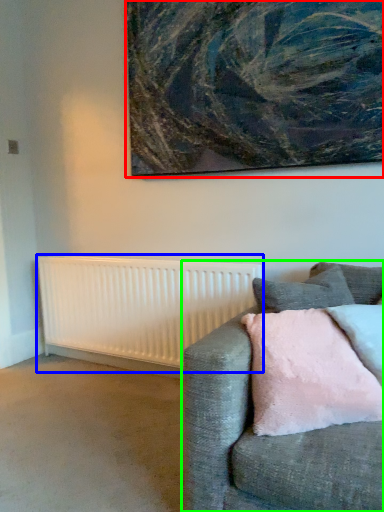
Question: Which is farther away from picture frame (highlighted by a red box)? radiator (highlighted by a blue box) or studio couch (highlighted by a green box)?

Choices:
 (A) radiator
 (B) studio couch

Answer: (B)